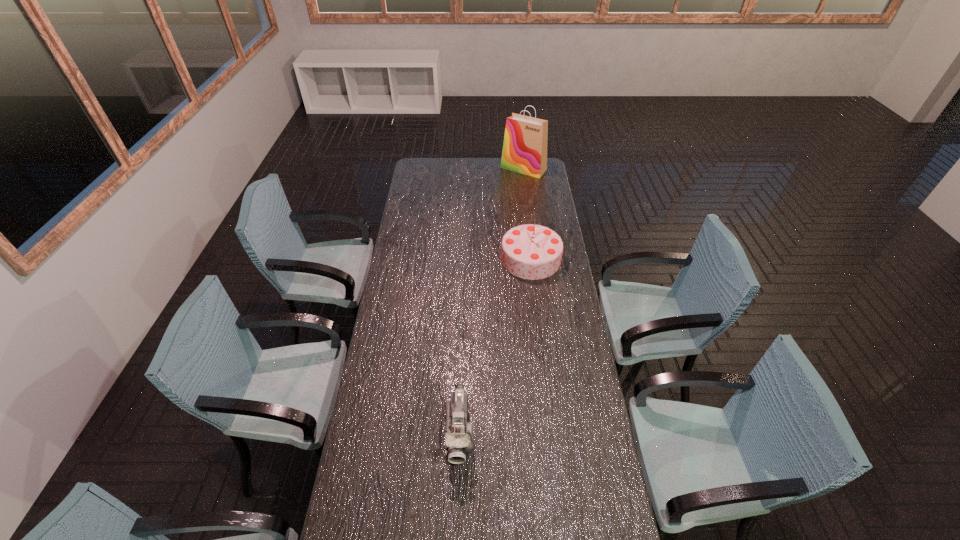
In order to click on object identified as the closest to the tallest object in this screenshot , I will do `click(529, 251)`.

This screenshot has height=540, width=960. Find the location of `vacant space that satisfies the following two spatial constraints: 1. on the back side of the farthest object; 2. on the left side of the second farthest object`. vacant space that satisfies the following two spatial constraints: 1. on the back side of the farthest object; 2. on the left side of the second farthest object is located at coordinates (520, 168).